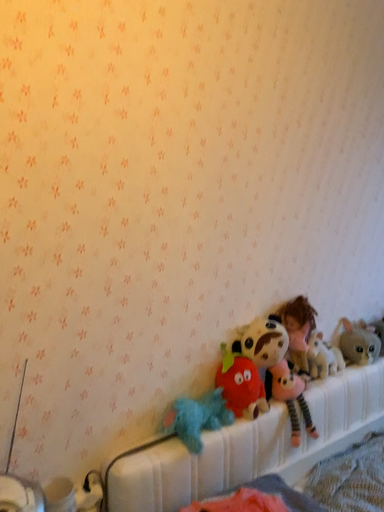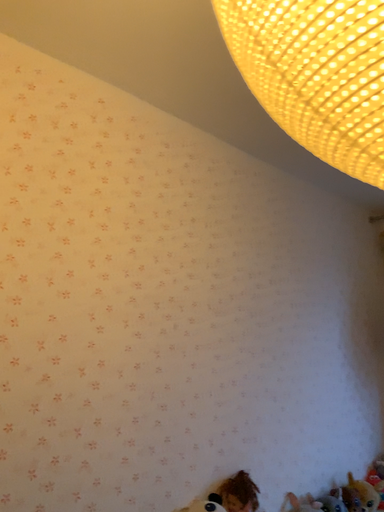
Question: How did the camera likely rotate when shooting the video?

Choices:
 (A) rotated upward
 (B) rotated downward

Answer: (A)